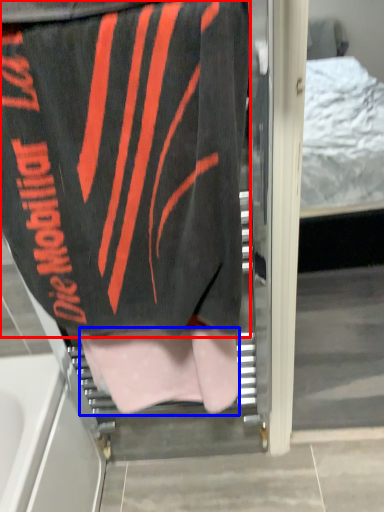
Question: Among these objects, which one is nearest to the camera, towel (highlighted by a red box) or underclothes (highlighted by a blue box)?

Choices:
 (A) towel
 (B) underclothes

Answer: (A)